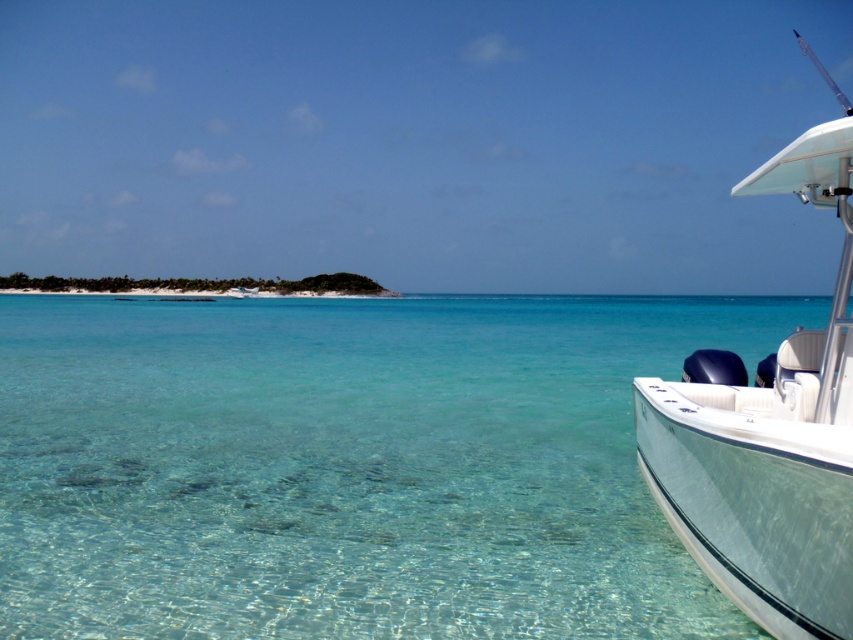
Which of these two, clear glassy water at lower right or white glossy boat at right, stands taller?

Standing taller between the two is white glossy boat at right.

Is clear glassy water at lower right thinner than white glossy boat at right?

Correct, clear glassy water at lower right's width is less than white glossy boat at right's.

What are the coordinates of `clear glassy water at lower right` in the screenshot? It's located at (349, 465).

At what (x,y) coordinates should I click in order to perform the action: click on clear glassy water at lower right. Please return your answer as a coordinate pair (x, y). The image size is (853, 640). Looking at the image, I should click on (349, 465).